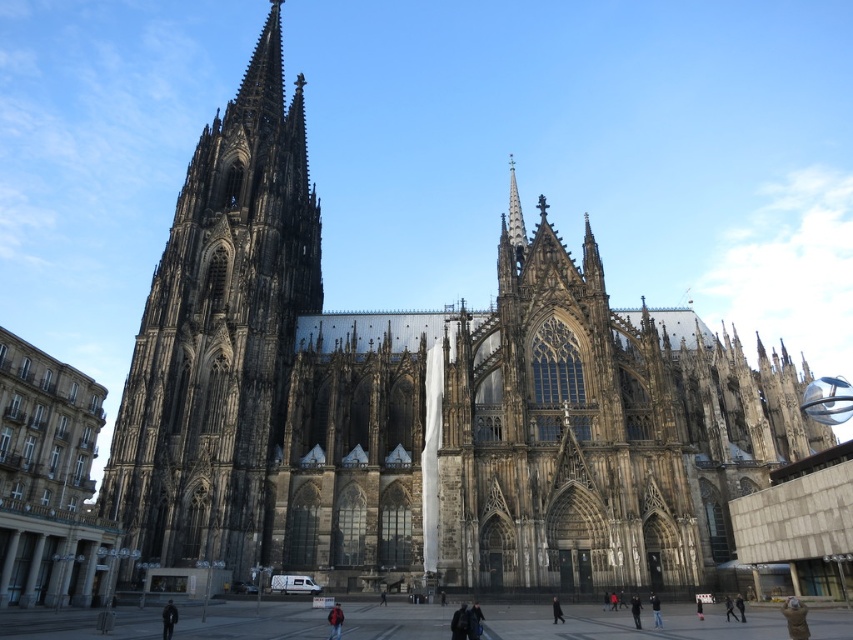
Looking at this image, you are standing in front of the Cologne Cathedral and want to take a photo that includes both the dark stone tower at left and the black fabric person at center. Considering their heights, which object should you focus on first to ensure both are fully visible in the frame?

The dark stone tower at left is taller than the black fabric person at center, so you should focus on including the dark stone tower at left first to ensure both are fully visible in the frame.

You are standing in front of the Cologne Cathedral and want to take a photo of the dark stone tower at left and the black fabric person at center. Which object is closer to the camera?

The dark stone tower at left is positioned over the black fabric person at center, so the dark stone tower at left is closer to the camera.

You are standing in front of the Cologne Cathedral and want to take a photo. You have two options for where to stand. The first option is at point [181,259] and the second option is at point [334,632]. Which point should you choose to be closer to the cathedral?

Point [334,632] is closer to the cathedral because point [181,259] is behind it.